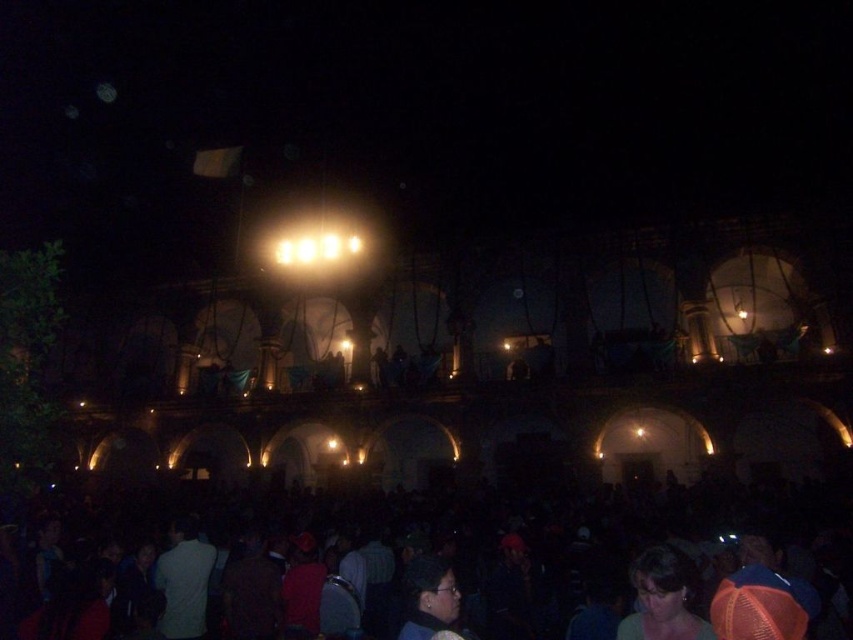
Question: Does smooth brown hair at lower right appear on the right side of matte black hair at lower center?

Choices:
 (A) yes
 (B) no

Answer: (A)

Question: Is smooth brown hair at lower right to the right of matte black hair at lower center from the viewer's perspective?

Choices:
 (A) yes
 (B) no

Answer: (A)

Question: Which of the following is the closest to the observer?

Choices:
 (A) matte black hair at lower center
 (B) smooth brown hair at lower right

Answer: (B)

Question: Which object appears closest to the camera in this image?

Choices:
 (A) matte black hair at lower center
 (B) dark matte crowd at lower center

Answer: (B)

Question: Does dark matte crowd at lower center appear on the right side of matte black hair at lower center?

Choices:
 (A) yes
 (B) no

Answer: (B)

Question: Which of the following is the farthest from the observer?

Choices:
 (A) matte black hair at lower center
 (B) dark matte crowd at lower center
 (C) smooth brown hair at lower right

Answer: (A)